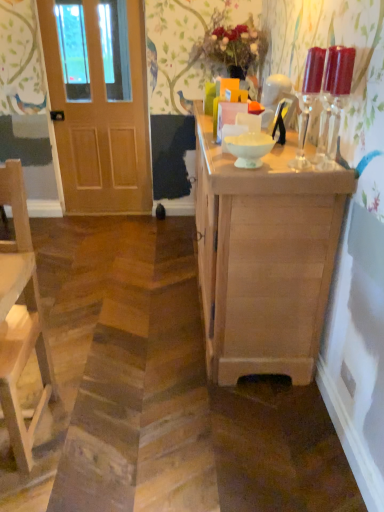
In order to click on vacant space situated on the left part of translucent glass candle holders at upper right, which appears as the 1th candle holder when viewed from the right in this screenshot , I will do `click(284, 161)`.